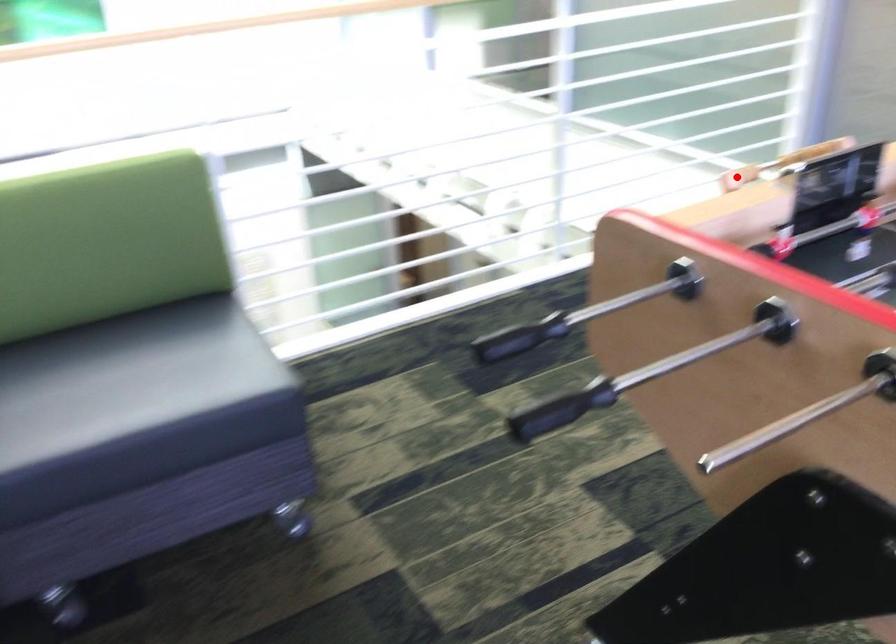
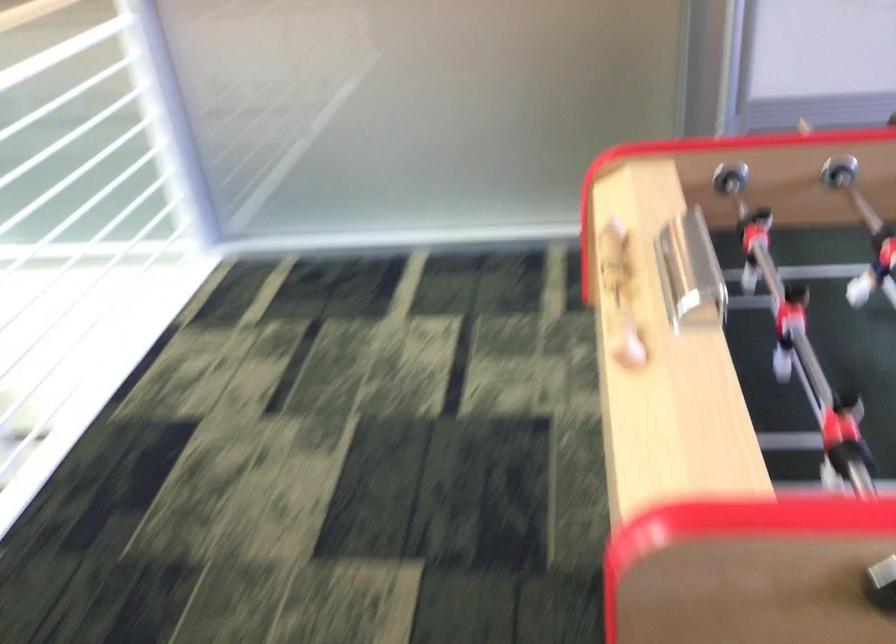
Question: I am providing you with two images of the same scene from different viewpoints. A red point is marked on the first image. At the location where the point appears in image 1, is it still visible in image 2?

Choices:
 (A) Yes
 (B) No

Answer: (A)